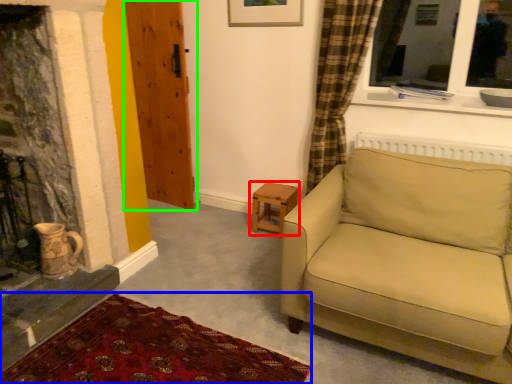
Question: Based on their relative distances, which object is farther from table (highlighted by a red box)? Choose from plain (highlighted by a blue box) and door (highlighted by a green box).

Choices:
 (A) plain
 (B) door

Answer: (A)